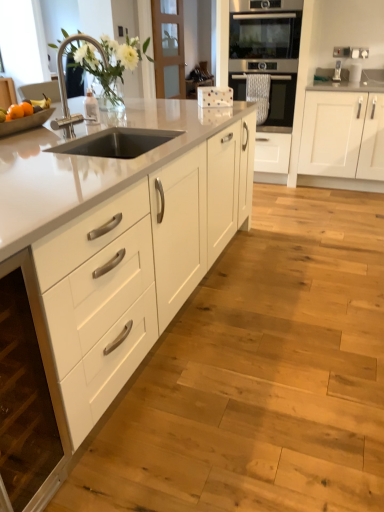
Find the location of a particular element. This screenshot has height=512, width=384. free space to the left of silver metallic faucet at upper left is located at coordinates (36, 139).